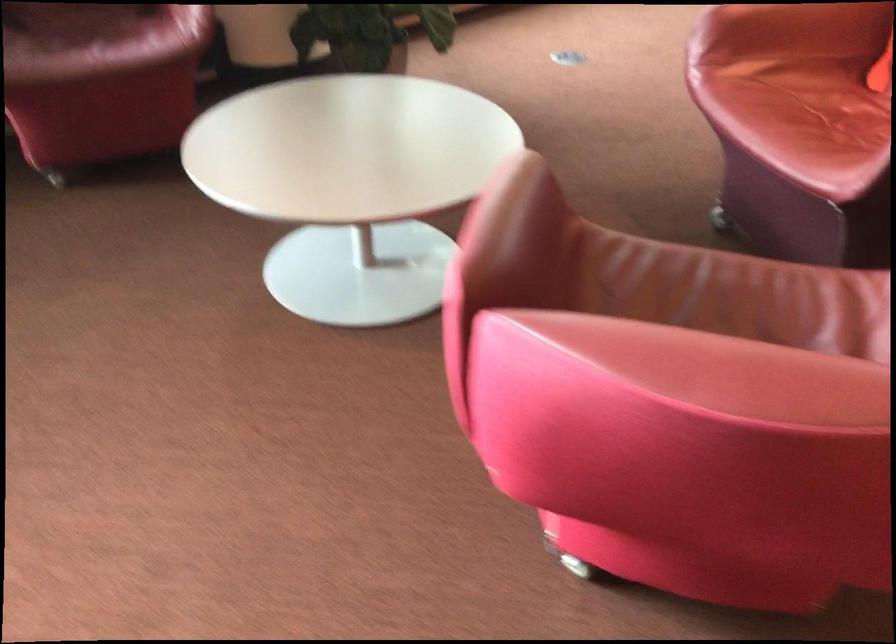
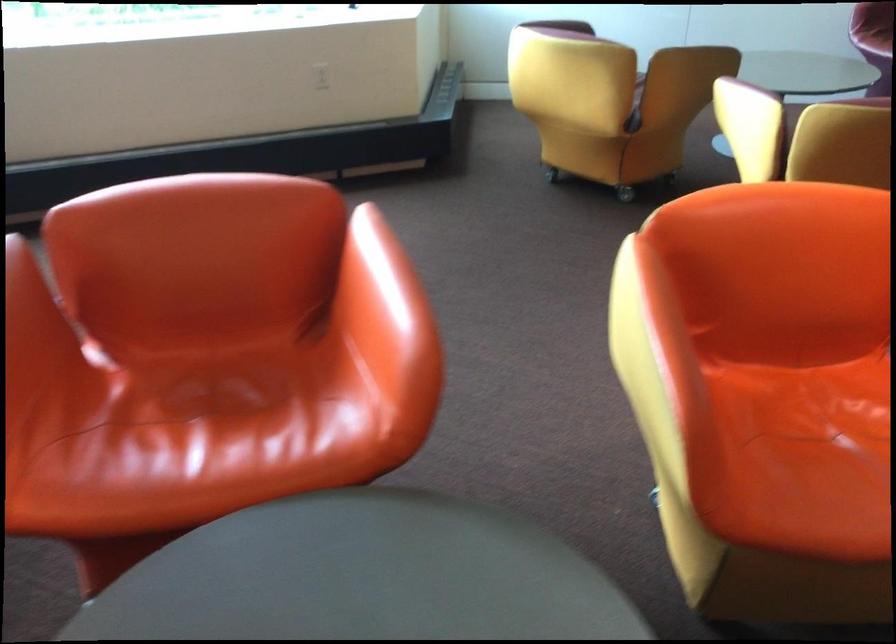
In a continuous first-person perspective shot, in which direction is the camera moving?

The cameraman moved toward right, forward.